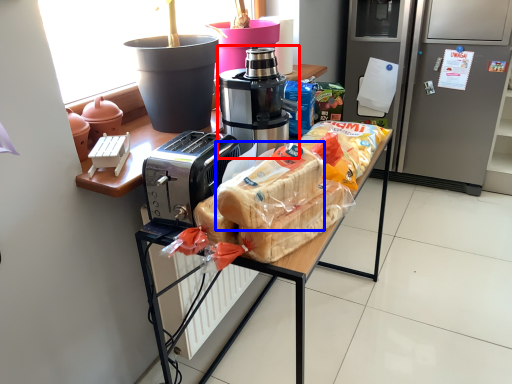
Question: Which of the following is the closest to the observer, coffee maker (highlighted by a red box) or snack (highlighted by a blue box)?

Choices:
 (A) coffee maker
 (B) snack

Answer: (B)